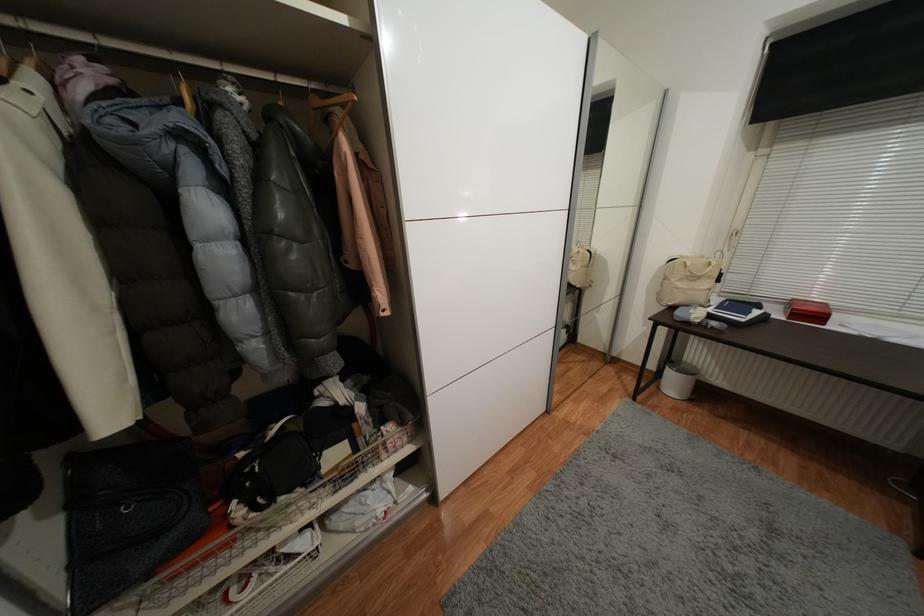
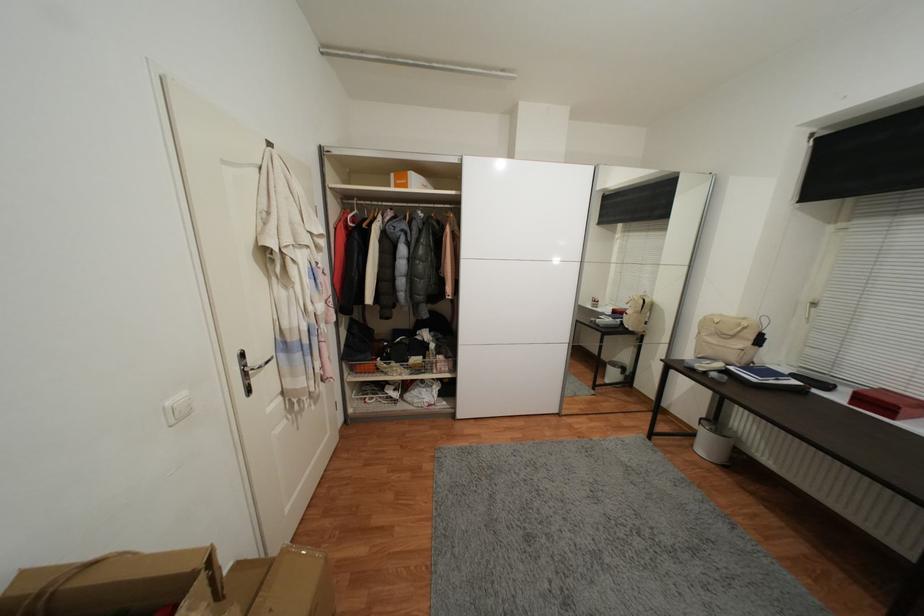
Where in the second image is the point corresponding to (x=707, y=257) from the first image?

(748, 321)